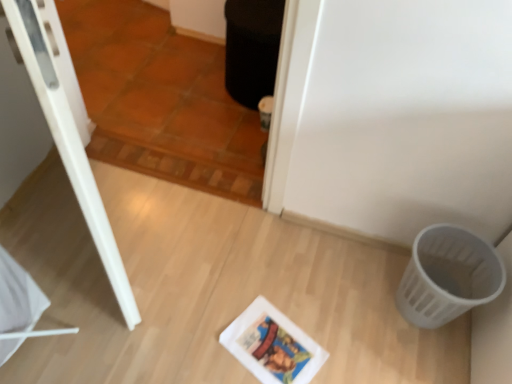
The image size is (512, 384). Find the location of `free point below white plastic basket at lower right (from a real-world perspective)`. free point below white plastic basket at lower right (from a real-world perspective) is located at coordinates (423, 330).